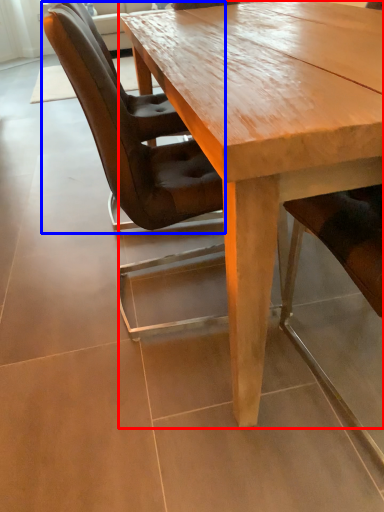
Question: Among these objects, which one is farthest to the camera, coffee table (highlighted by a red box) or chair (highlighted by a blue box)?

Choices:
 (A) coffee table
 (B) chair

Answer: (B)